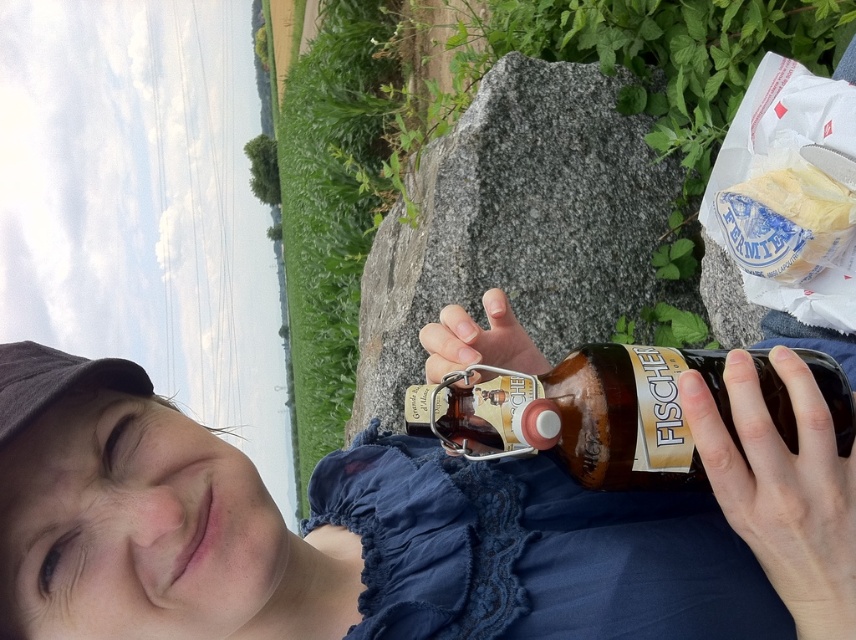
Which of these two, brown rock at center or brown glass bottle at center, stands shorter?

Standing shorter between the two is brown glass bottle at center.

Is brown rock at center thinner than brown glass bottle at center?

No, brown rock at center is not thinner than brown glass bottle at center.

I want to click on brown rock at center, so click(519, 225).

Find the location of a particular element. brown rock at center is located at coordinates (519, 225).

Measure the distance between matte blue dress at lower center and camera.

20.73 inches

Can you confirm if matte blue dress at lower center is taller than brown rock at center?

No, matte blue dress at lower center is not taller than brown rock at center.

Where is `matte blue dress at lower center`? matte blue dress at lower center is located at coordinates (406, 529).

Identify the location of matte blue dress at lower center. (406, 529).

Which is behind, point (795, 595) or point (693, 456)?

Point (693, 456)

Does point (749, 611) come behind point (639, 413)?

Yes, it is behind point (639, 413).

Which is in front, point (631, 573) or point (504, 387)?

Point (504, 387) is in front.

Locate an element on the screen. The image size is (856, 640). matte blue dress at lower center is located at coordinates (406, 529).